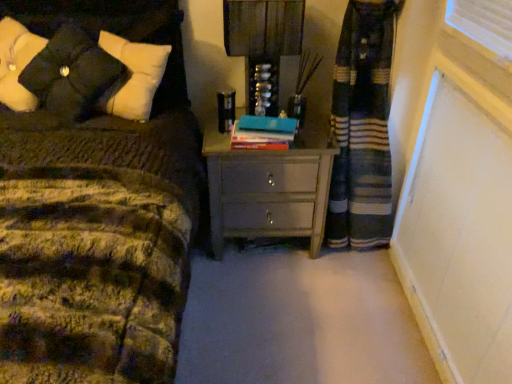
Question: In terms of width, does black matte pillow at upper left look wider or thinner when compared to matte gray chest of drawers at center?

Choices:
 (A) thin
 (B) wide

Answer: (A)

Question: Based on their positions, is black matte pillow at upper left located to the left or right of matte gray chest of drawers at center?

Choices:
 (A) right
 (B) left

Answer: (B)

Question: Which object is the closest to the hardcover book at center?

Choices:
 (A) matte gray chest of drawers at center
 (B) matte black lampshade at upper center
 (C) black matte pillow at upper left

Answer: (A)

Question: Based on their relative distances, which object is nearer to the matte gray chest of drawers at center?

Choices:
 (A) hardcover book at center
 (B) matte black lampshade at upper center
 (C) black matte pillow at upper left

Answer: (A)